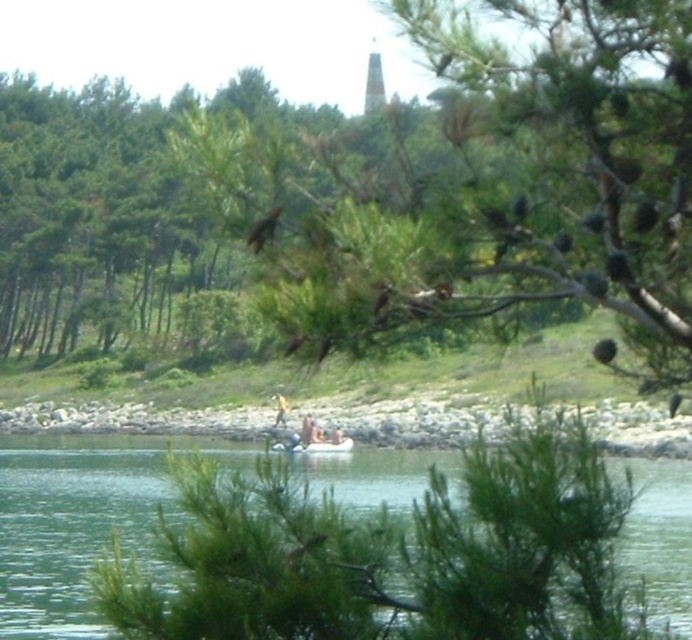
Looking at this image, does green water at center appear on the right side of gray rocky shoreline at lower center?

In fact, green water at center is to the left of gray rocky shoreline at lower center.

Is point (62, 552) in front of point (385, 416)?

That is True.

Who is more forward, (84,586) or (450,432)?

Point (84,586) is in front.

The width and height of the screenshot is (692, 640). What are the coordinates of `green water at center` in the screenshot? It's located at (80, 520).